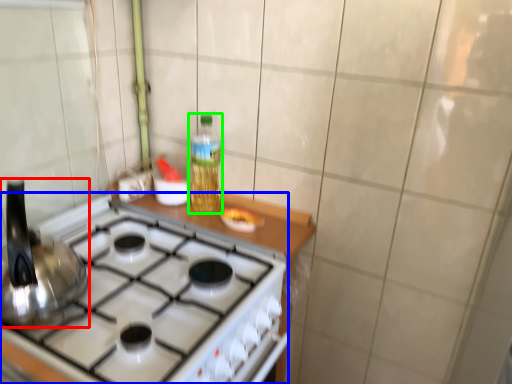
Question: Which object is positioned farthest from kitchen appliance (highlighted by a red box)? Select from gas stove (highlighted by a blue box) and bottle (highlighted by a green box).

Choices:
 (A) gas stove
 (B) bottle

Answer: (B)